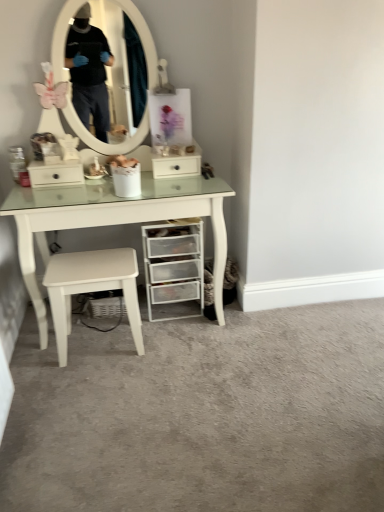
Question: Is clear plastic drawers at lower right to the right of white glossy drawer at center from the viewer's perspective?

Choices:
 (A) yes
 (B) no

Answer: (B)

Question: From a real-world perspective, is clear plastic drawers at lower right beneath white glossy drawer at center?

Choices:
 (A) yes
 (B) no

Answer: (A)

Question: Would you say clear plastic drawers at lower right is a long distance from white glossy drawer at center?

Choices:
 (A) no
 (B) yes

Answer: (A)

Question: Does clear plastic drawers at lower right have a lesser height compared to white glossy drawer at center?

Choices:
 (A) yes
 (B) no

Answer: (B)

Question: From the image's perspective, is clear plastic drawers at lower right located above white glossy drawer at center?

Choices:
 (A) no
 (B) yes

Answer: (A)

Question: From the image's perspective, is clear plastic drawers at lower right below white glossy drawer at center?

Choices:
 (A) no
 (B) yes

Answer: (B)

Question: Could you tell me if white glossy table at center is facing white glossy drawer at center?

Choices:
 (A) no
 (B) yes

Answer: (B)

Question: Is white glossy table at center looking in the opposite direction of white glossy drawer at center?

Choices:
 (A) yes
 (B) no

Answer: (A)

Question: Considering the relative sizes of white glossy table at center and white glossy drawer at center in the image provided, is white glossy table at center bigger than white glossy drawer at center?

Choices:
 (A) no
 (B) yes

Answer: (B)

Question: Is white glossy drawer at center surrounded by white glossy table at center?

Choices:
 (A) no
 (B) yes

Answer: (B)

Question: Can you confirm if white glossy table at center is thinner than white glossy drawer at center?

Choices:
 (A) yes
 (B) no

Answer: (B)

Question: Is white glossy table at center not within white glossy drawer at center?

Choices:
 (A) yes
 (B) no

Answer: (A)

Question: Does white matte stool at lower center have a larger size compared to clear plastic drawers at lower right?

Choices:
 (A) no
 (B) yes

Answer: (A)